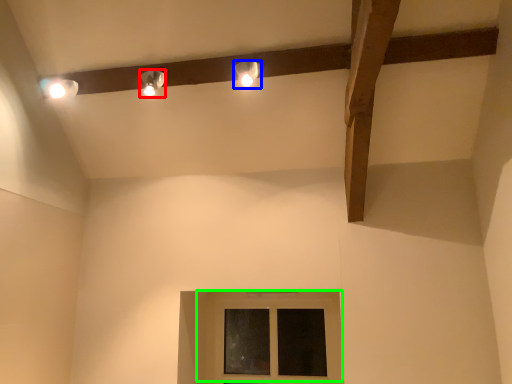
Question: Which object is the closest to the lamp (highlighted by a red box)? Choose among these: lamp (highlighted by a blue box) or window (highlighted by a green box).

Choices:
 (A) lamp
 (B) window

Answer: (A)